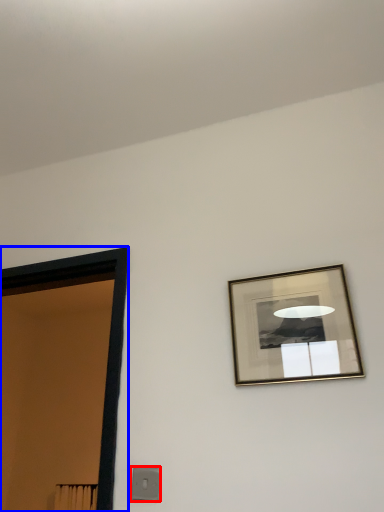
Question: Which of the following is the farthest to the observer, light switch (highlighted by a red box) or door (highlighted by a blue box)?

Choices:
 (A) light switch
 (B) door

Answer: (B)